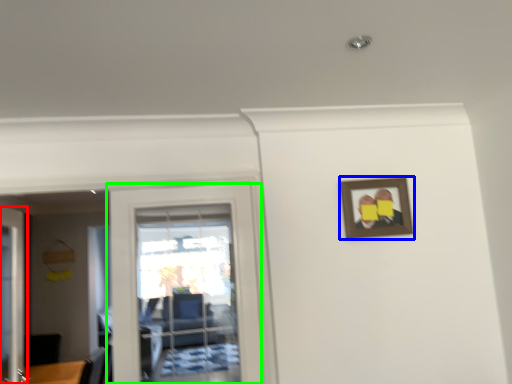
Question: Which object is the closest to the door (highlighted by a red box)? Choose among these: picture frame (highlighted by a blue box) or door (highlighted by a green box).

Choices:
 (A) picture frame
 (B) door

Answer: (B)